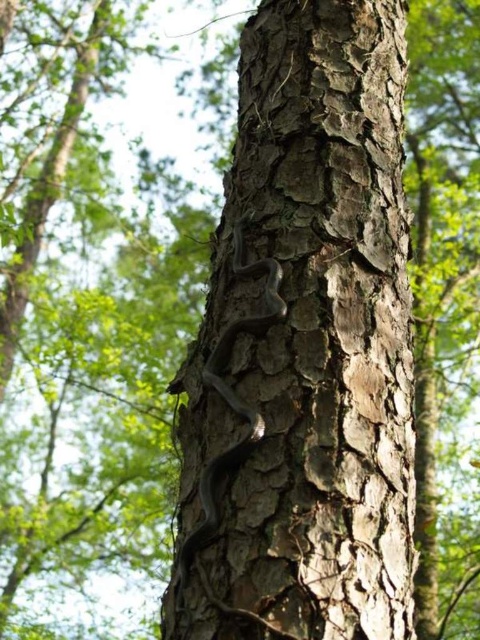
Question: Among these objects, which one is farthest from the camera?

Choices:
 (A) smooth bark tree trunk at center
 (B) shiny black snake at center

Answer: (B)

Question: Is smooth bark tree trunk at center wider than shiny black snake at center?

Choices:
 (A) yes
 (B) no

Answer: (A)

Question: Is smooth bark tree trunk at center positioned before shiny black snake at center?

Choices:
 (A) no
 (B) yes

Answer: (B)

Question: Among these points, which one is farthest from the camera?

Choices:
 (A) (344, 44)
 (B) (228, 346)

Answer: (A)

Question: Can you confirm if smooth bark tree trunk at center is bigger than shiny black snake at center?

Choices:
 (A) yes
 (B) no

Answer: (A)